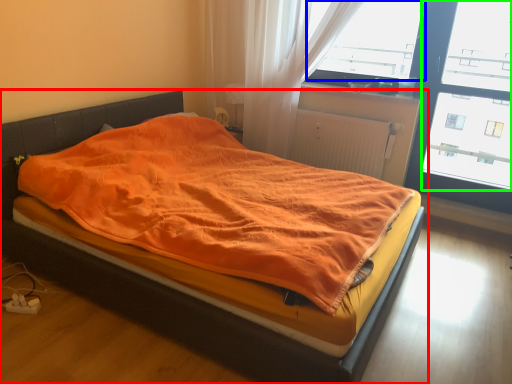
Question: Which object is positioned closest to bed (highlighted by a red box)? Select from window screen (highlighted by a blue box) and window screen (highlighted by a green box).

Choices:
 (A) window screen
 (B) window screen

Answer: (A)